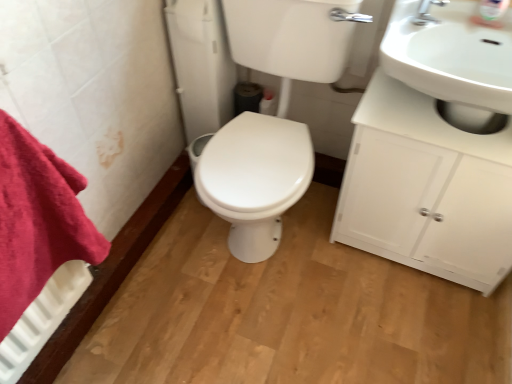
Question: Is white glossy cabinet at right to the left of red cotton towel at left from the viewer's perspective?

Choices:
 (A) yes
 (B) no

Answer: (B)

Question: Is white glossy cabinet at right facing towards red cotton towel at left?

Choices:
 (A) no
 (B) yes

Answer: (A)

Question: Is the position of white glossy cabinet at right less distant than that of red cotton towel at left?

Choices:
 (A) no
 (B) yes

Answer: (A)

Question: Is white glossy cabinet at right surrounding red cotton towel at left?

Choices:
 (A) yes
 (B) no

Answer: (B)

Question: From a real-world perspective, does white glossy cabinet at right sit lower than red cotton towel at left?

Choices:
 (A) yes
 (B) no

Answer: (A)

Question: From a real-world perspective, is white glossy cabinet at right above or below white glossy sink at upper right?

Choices:
 (A) above
 (B) below

Answer: (B)

Question: Based on their positions, is white glossy cabinet at right located to the left or right of white glossy sink at upper right?

Choices:
 (A) right
 (B) left

Answer: (A)

Question: Is white glossy cabinet at right taller or shorter than white glossy sink at upper right?

Choices:
 (A) tall
 (B) short

Answer: (A)

Question: Is white glossy cabinet at right bigger or smaller than white glossy sink at upper right?

Choices:
 (A) small
 (B) big

Answer: (B)

Question: In terms of height, does white glossy toilet at center look taller or shorter compared to white glossy cabinet at right?

Choices:
 (A) tall
 (B) short

Answer: (A)

Question: Relative to white glossy cabinet at right, is white glossy toilet at center in front or behind?

Choices:
 (A) front
 (B) behind

Answer: (A)

Question: From the image's perspective, is white glossy toilet at center above or below white glossy cabinet at right?

Choices:
 (A) below
 (B) above

Answer: (B)

Question: Based on their sizes in the image, would you say white glossy toilet at center is bigger or smaller than white glossy cabinet at right?

Choices:
 (A) big
 (B) small

Answer: (A)

Question: Visually, is white glossy toilet at center positioned to the left or to the right of white glossy sink at upper right?

Choices:
 (A) right
 (B) left

Answer: (B)

Question: Do you think white glossy toilet at center is within white glossy sink at upper right, or outside of it?

Choices:
 (A) inside
 (B) outside

Answer: (B)